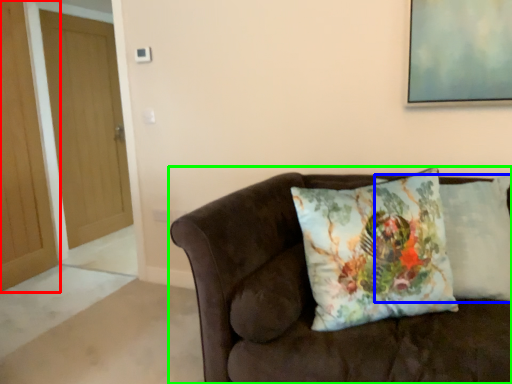
Question: Based on their relative distances, which object is farther from door (highlighted by a red box)? Choose from pillow (highlighted by a blue box) and studio couch (highlighted by a green box).

Choices:
 (A) pillow
 (B) studio couch

Answer: (A)